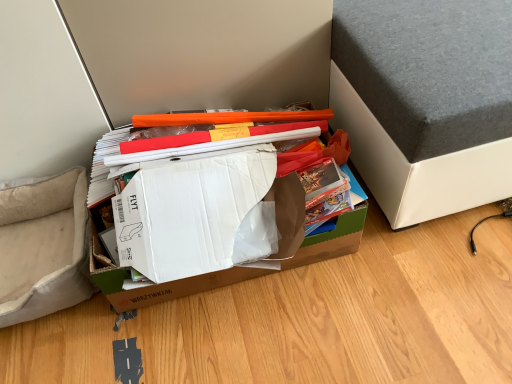
Question: Does brown cardboard box at center have a lesser height compared to gray fabric bed at upper right?

Choices:
 (A) yes
 (B) no

Answer: (A)

Question: Does brown cardboard box at center have a greater height compared to gray fabric bed at upper right?

Choices:
 (A) no
 (B) yes

Answer: (A)

Question: From a real-world perspective, is brown cardboard box at center under gray fabric bed at upper right?

Choices:
 (A) no
 (B) yes

Answer: (B)

Question: Is brown cardboard box at center outside of gray fabric bed at upper right?

Choices:
 (A) yes
 (B) no

Answer: (A)

Question: Is brown cardboard box at center bigger than gray fabric bed at upper right?

Choices:
 (A) yes
 (B) no

Answer: (B)

Question: From a real-world perspective, is brown cardboard box at center positioned above or below beige fabric armchair at lower left?

Choices:
 (A) above
 (B) below

Answer: (A)

Question: Looking at their shapes, would you say brown cardboard box at center is wider or thinner than beige fabric armchair at lower left?

Choices:
 (A) thin
 (B) wide

Answer: (B)

Question: From their relative heights in the image, would you say brown cardboard box at center is taller or shorter than beige fabric armchair at lower left?

Choices:
 (A) tall
 (B) short

Answer: (A)

Question: Is point (96, 283) closer or farther from the camera than point (25, 264)?

Choices:
 (A) farther
 (B) closer

Answer: (B)

Question: Would you say gray fabric bed at upper right is to the left or to the right of beige fabric armchair at lower left in the picture?

Choices:
 (A) right
 (B) left

Answer: (A)

Question: From a real-world perspective, is gray fabric bed at upper right physically located above or below beige fabric armchair at lower left?

Choices:
 (A) above
 (B) below

Answer: (A)

Question: Considering the positions of gray fabric bed at upper right and beige fabric armchair at lower left in the image, is gray fabric bed at upper right taller or shorter than beige fabric armchair at lower left?

Choices:
 (A) tall
 (B) short

Answer: (A)

Question: In terms of size, does gray fabric bed at upper right appear bigger or smaller than beige fabric armchair at lower left?

Choices:
 (A) big
 (B) small

Answer: (A)

Question: From the image's perspective, is beige fabric armchair at lower left above or below brown cardboard box at center?

Choices:
 (A) below
 (B) above

Answer: (A)

Question: Relative to brown cardboard box at center, is beige fabric armchair at lower left in front or behind?

Choices:
 (A) behind
 (B) front

Answer: (A)